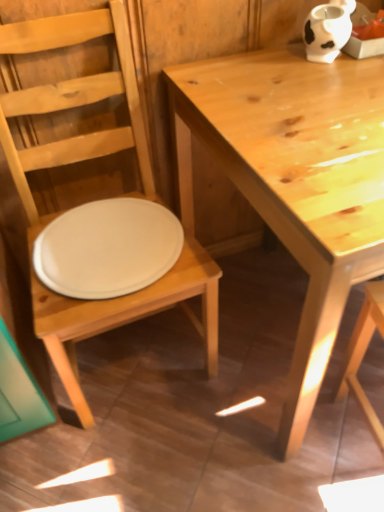
You are a GUI agent. You are given a task and a screenshot of the screen. Output one action in this format:
    pyautogui.click(x=<x>, y=<y>)
    Task: Click on the light brown wooden table at center
    The height and width of the screenshot is (512, 384).
    Given the screenshot: What is the action you would take?
    pyautogui.click(x=295, y=180)

Can you see matte white plate at left touching white matte cow-shaped vase at upper right?

No, matte white plate at left is not next to white matte cow-shaped vase at upper right.

You are a GUI agent. You are given a task and a screenshot of the screen. Output one action in this format:
    pyautogui.click(x=<x>, y=<y>)
    Task: Click on the chair located below the white matte cow-shaped vase at upper right (from the image's perspective)
    The height and width of the screenshot is (512, 384).
    Given the screenshot: What is the action you would take?
    pyautogui.click(x=71, y=111)

From the image's perspective, which one is positioned higher, matte white plate at left or white matte cow-shaped vase at upper right?

white matte cow-shaped vase at upper right, from the image's perspective.

How different are the orientations of matte white plate at left and white matte cow-shaped vase at upper right in degrees?

matte white plate at left and white matte cow-shaped vase at upper right are facing 0.537 degrees away from each other.

Is light brown wooden table at center oriented away from matte white plate at left?

No, matte white plate at left is not at the back of light brown wooden table at center.

Is point (364, 169) behind point (59, 100)?

No, (364, 169) is in front of (59, 100).

In the image, is light brown wooden table at center on the left side or the right side of matte white plate at left?

light brown wooden table at center is to the right of matte white plate at left.

From a real-world perspective, which object stands above the other?

matte white plate at left is physically above.

From the image's perspective, does matte white plate at left appear higher than light brown wooden table at center?

No, from the image's perspective, matte white plate at left is not over light brown wooden table at center.

Are matte white plate at left and light brown wooden table at center beside each other?

matte white plate at left and light brown wooden table at center are clearly separated.

How many degrees apart are the facing directions of matte white plate at left and light brown wooden table at center?

0.672 degrees separate the facing orientations of matte white plate at left and light brown wooden table at center.

From the image's perspective, is light brown wooden table at center below white matte plate at center?

Actually, light brown wooden table at center appears above white matte plate at center in the image.

Is light brown wooden table at center positioned with its back to white matte plate at center?

light brown wooden table at center does not have its back to white matte plate at center.

What's the angular difference between light brown wooden table at center and white matte plate at center's facing directions?

They differ by 0.672 degrees in their facing directions.

Looking at this image, which object is further away from the camera taking this photo, light brown wooden table at center or white matte plate at center?

white matte plate at center is further from the camera.

Can you confirm if white matte plate at center is wider than light brown wooden table at center?

In fact, white matte plate at center might be narrower than light brown wooden table at center.

Which object is further away from the camera taking this photo, white matte plate at center or light brown wooden table at center?

Positioned behind is white matte plate at center.

Does point (89, 245) come farther from viewer compared to point (247, 84)?

Yes.

Is white matte plate at center outside of light brown wooden table at center?

That's correct, white matte plate at center is outside of light brown wooden table at center.

Does white matte cow-shaped vase at upper right touch light brown wooden table at center?

They are not placed beside each other.

Locate an element on the screen. The image size is (384, 512). vase on the left of light brown wooden table at center is located at coordinates (327, 30).

Which object is further away from the camera taking this photo, white matte cow-shaped vase at upper right or light brown wooden table at center?

white matte cow-shaped vase at upper right is further from the camera.

Consider the image. Is white matte cow-shaped vase at upper right oriented away from light brown wooden table at center?

No, light brown wooden table at center is not at the back of white matte cow-shaped vase at upper right.

Considering the sizes of objects light brown wooden table at center and white matte cow-shaped vase at upper right in the image provided, who is smaller, light brown wooden table at center or white matte cow-shaped vase at upper right?

With smaller size is white matte cow-shaped vase at upper right.

Which is behind, point (300, 261) or point (340, 48)?

The point (340, 48) is farther from the camera.

In terms of height, does light brown wooden table at center look taller or shorter compared to white matte cow-shaped vase at upper right?

In the image, light brown wooden table at center appears to be taller than white matte cow-shaped vase at upper right.

I want to click on vase above the matte white plate at left (from a real-world perspective), so click(x=327, y=30).

At what (x,y) coordinates should I click in order to perform the action: click on table behind the matte white plate at left. Please return your answer as a coordinate pair (x, y). The width and height of the screenshot is (384, 512). Looking at the image, I should click on (295, 180).

Which object lies further to the anchor point light brown wooden table at center, white matte cow-shaped vase at upper right or white matte plate at center?

white matte cow-shaped vase at upper right.

Estimate the real-world distances between objects in this image. Which object is closer to white matte cow-shaped vase at upper right, matte white plate at left or white matte plate at center?

matte white plate at left is positioned closer to the anchor white matte cow-shaped vase at upper right.

Considering their positions, is white matte plate at center positioned closer to white matte cow-shaped vase at upper right than light brown wooden table at center?

light brown wooden table at center is closer to white matte cow-shaped vase at upper right.

From the image, which object appears to be nearer to matte white plate at left, white matte plate at center or light brown wooden table at center?

white matte plate at center.

From the image, which object appears to be nearer to white matte cow-shaped vase at upper right, matte white plate at left or light brown wooden table at center?

Based on the image, light brown wooden table at center appears to be nearer to white matte cow-shaped vase at upper right.

Based on their spatial positions, is white matte plate at center or matte white plate at left further from light brown wooden table at center?

white matte plate at center lies further to light brown wooden table at center than the other object.

Considering their positions, is white matte cow-shaped vase at upper right positioned further to white matte plate at center than matte white plate at left?

Based on the image, white matte cow-shaped vase at upper right appears to be further to white matte plate at center.

Looking at the image, which one is located further to white matte cow-shaped vase at upper right, light brown wooden table at center or white matte plate at center?

Among the two, white matte plate at center is located further to white matte cow-shaped vase at upper right.

Find the location of `vase between matte white plate at left and light brown wooden table at center in the horizontal direction`. vase between matte white plate at left and light brown wooden table at center in the horizontal direction is located at coordinates (327, 30).

Identify the location of plate between matte white plate at left and white matte cow-shaped vase at upper right in the horizontal direction. (108, 248).

The image size is (384, 512). Identify the location of plate situated between matte white plate at left and light brown wooden table at center from left to right. (108, 248).

At what (x,y) coordinates should I click in order to perform the action: click on vase between white matte plate at center and light brown wooden table at center in the horizontal direction. Please return your answer as a coordinate pair (x, y). The height and width of the screenshot is (512, 384). Looking at the image, I should click on (327, 30).